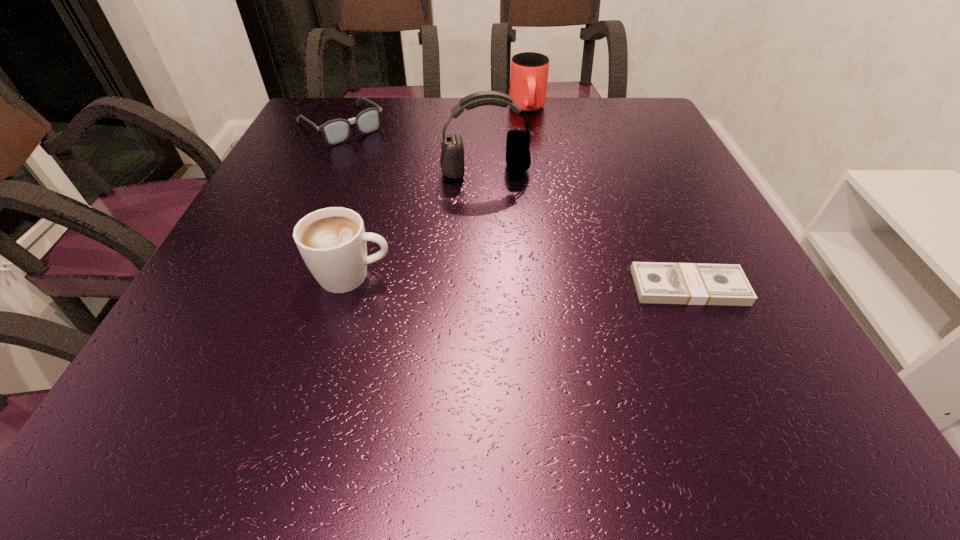
Locate an element on the screen. This screenshot has height=540, width=960. cappuccino is located at coordinates (332, 241).

Locate an element on the screen. This screenshot has height=540, width=960. the shortest object is located at coordinates (657, 283).

Locate an element on the screen. dollar is located at coordinates (657, 283).

This screenshot has width=960, height=540. In order to click on cup in this screenshot , I will do `click(529, 71)`.

You are a GUI agent. You are given a task and a screenshot of the screen. Output one action in this format:
    pyautogui.click(x=<x>, y=<y>)
    Task: Click on the tallest object
    
    Given the screenshot: What is the action you would take?
    pyautogui.click(x=518, y=159)

Image resolution: width=960 pixels, height=540 pixels. What are the coordinates of `headset` in the screenshot? It's located at [x=518, y=159].

The height and width of the screenshot is (540, 960). What are the coordinates of `spectacles` in the screenshot? It's located at (335, 131).

Locate an element on the screen. free spot located with the handle on the side of the cappuccino is located at coordinates (585, 276).

The image size is (960, 540). Identify the location of vacant space located on the back of the dollar. (652, 206).

You are a GUI agent. You are given a task and a screenshot of the screen. Output one action in this format:
    pyautogui.click(x=<x>, y=<y>)
    Task: Click on the vacant space located 0.240m on the handle side of the cup
    
    Given the screenshot: What is the action you would take?
    pyautogui.click(x=538, y=171)